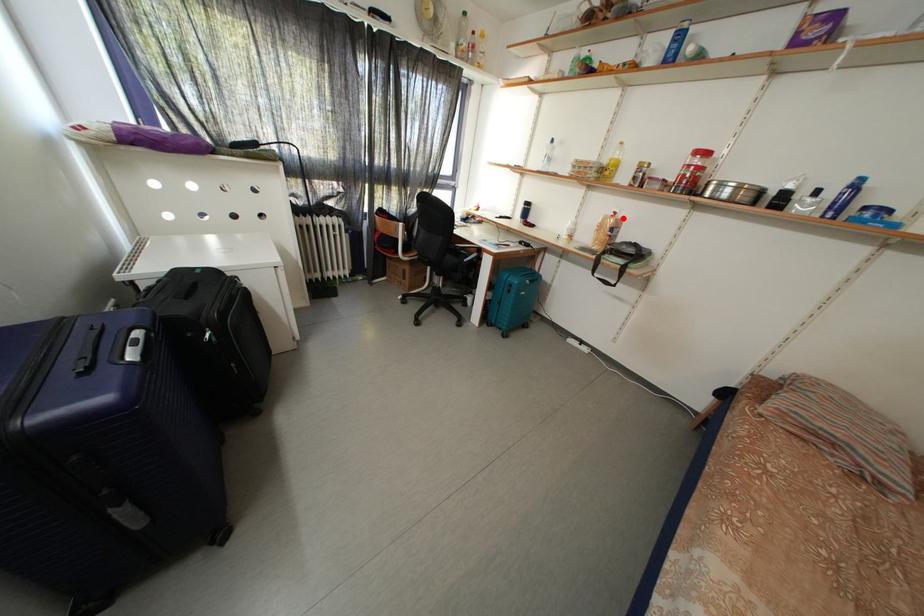
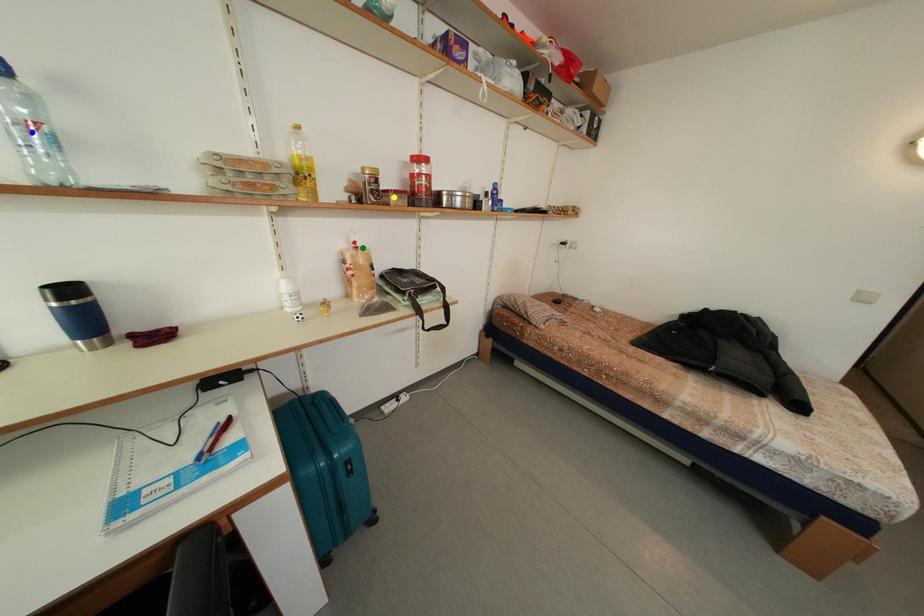
Question: I am providing you with two images of the same scene from different viewpoints. A red point is marked on the first image. You are given multiple points on the second image. In image 2, which mark is for the same physical point as the one in image 1?

Choices:
 (A) blue point
 (B) green point
 (C) yellow point

Answer: (B)